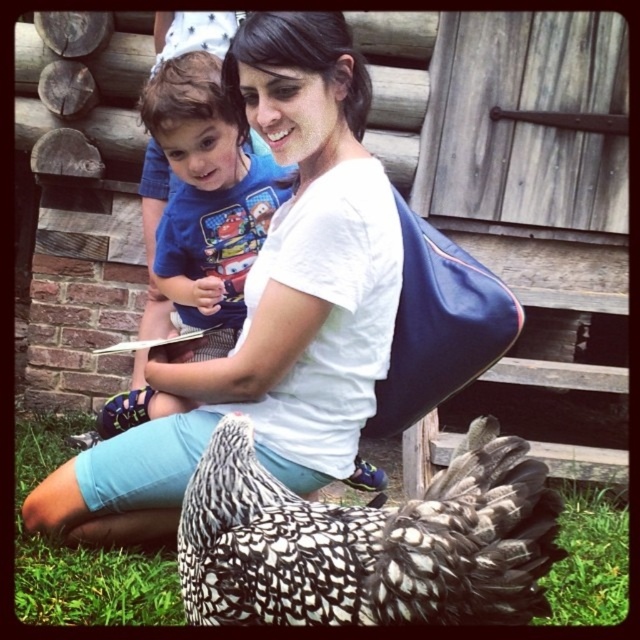
The height and width of the screenshot is (640, 640). What do you see at coordinates (368, 541) in the screenshot?
I see `black and white speckled feathered chicken at lower center` at bounding box center [368, 541].

Is point (221, 560) closer to viewer compared to point (218, 157)?

Yes, point (221, 560) is in front of point (218, 157).

You are a GUI agent. You are given a task and a screenshot of the screen. Output one action in this format:
    pyautogui.click(x=<x>, y=<y>)
    Task: Click on the black and white speckled feathered chicken at lower center
    Image resolution: width=640 pixels, height=640 pixels.
    Given the screenshot: What is the action you would take?
    pyautogui.click(x=368, y=541)

Does white matte shirt at center have a greater width compared to black and white speckled feathered chicken at lower center?

Correct, the width of white matte shirt at center exceeds that of black and white speckled feathered chicken at lower center.

Can you confirm if white matte shirt at center is positioned above black and white speckled feathered chicken at lower center?

Yes, white matte shirt at center is above black and white speckled feathered chicken at lower center.

What do you see at coordinates (268, 305) in the screenshot? The height and width of the screenshot is (640, 640). I see `white matte shirt at center` at bounding box center [268, 305].

This screenshot has width=640, height=640. I want to click on white matte shirt at center, so click(x=268, y=305).

Between white matte shirt at center and blue cotton shirt at center, which one appears on the right side from the viewer's perspective?

Positioned to the right is white matte shirt at center.

Is point (193, 416) in front of point (228, 320)?

Yes, point (193, 416) is in front of point (228, 320).

Identify the location of white matte shirt at center. Image resolution: width=640 pixels, height=640 pixels. click(x=268, y=305).